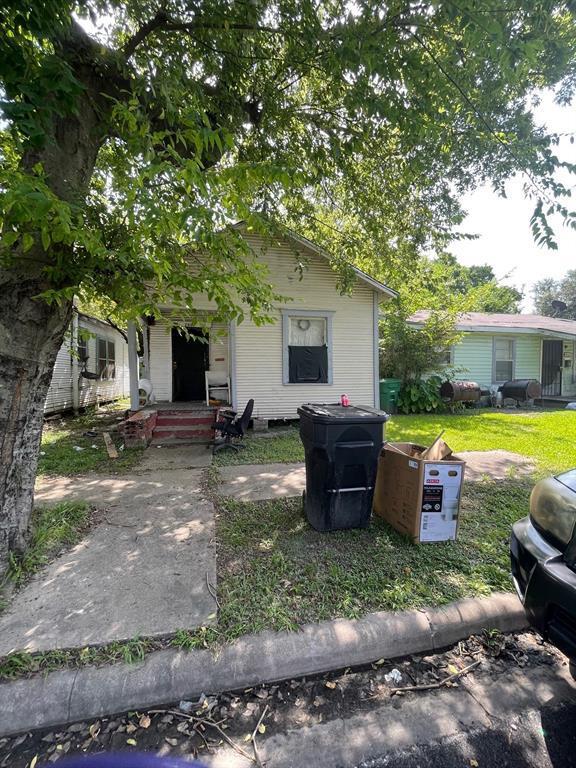
Where is `trash`? The width and height of the screenshot is (576, 768). trash is located at coordinates (447, 494).